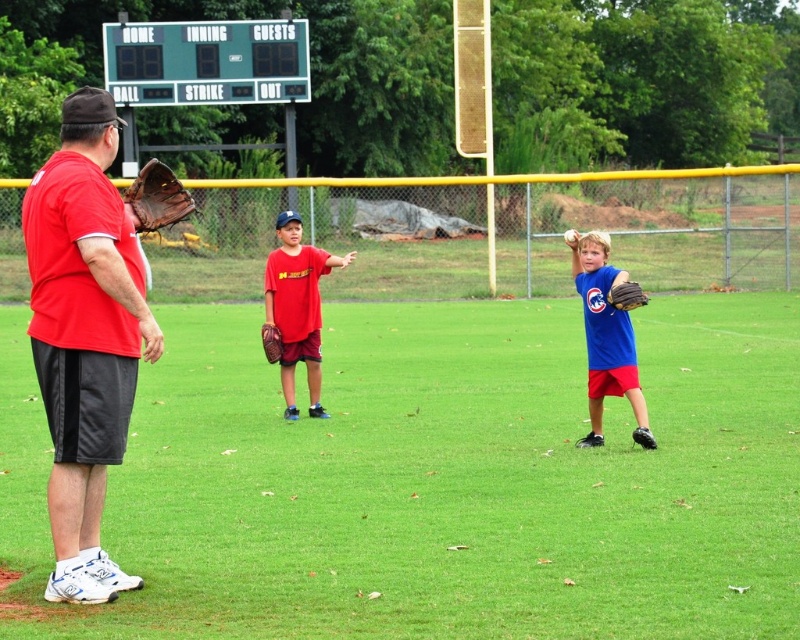
You are a photographer trying to capture a photo of the matte red shirt at center and the brown leather glove at center. If you want to ensure both are fully visible in the frame without cropping, which object should you position closer to the camera to avoid overlap?

You should position the matte red shirt at center closer to the camera since it might be wider than the brown leather glove at center, reducing the chance of overlap.